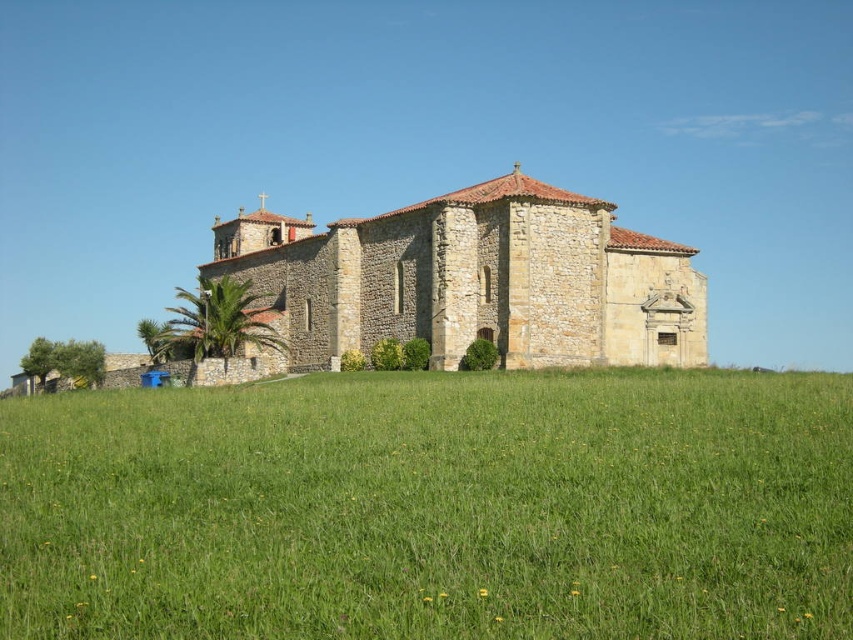
Who is more forward, (741, 392) or (428, 198)?

Point (741, 392)

Where is `green grass at lower center`? Image resolution: width=853 pixels, height=640 pixels. green grass at lower center is located at coordinates (432, 508).